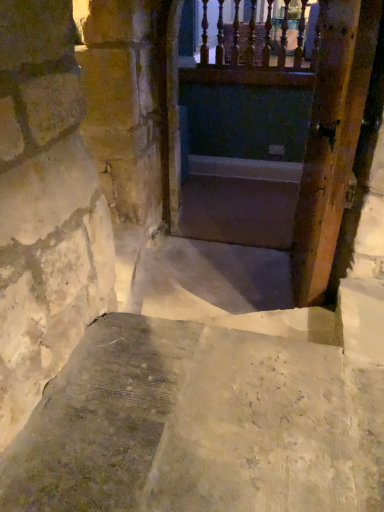
Question: Is wooden door at right inside the boundaries of wooden railing at upper center, or outside?

Choices:
 (A) inside
 (B) outside

Answer: (B)

Question: Is wooden door at right taller or shorter than wooden railing at upper center?

Choices:
 (A) short
 (B) tall

Answer: (B)

Question: Which of these objects is positioned farthest from the wooden door at right?

Choices:
 (A) wooden railing at upper center
 (B) smooth concrete stairs at center

Answer: (A)

Question: Estimate the real-world distances between objects in this image. Which object is closer to the wooden door at right?

Choices:
 (A) smooth concrete stairs at center
 (B) wooden railing at upper center

Answer: (A)